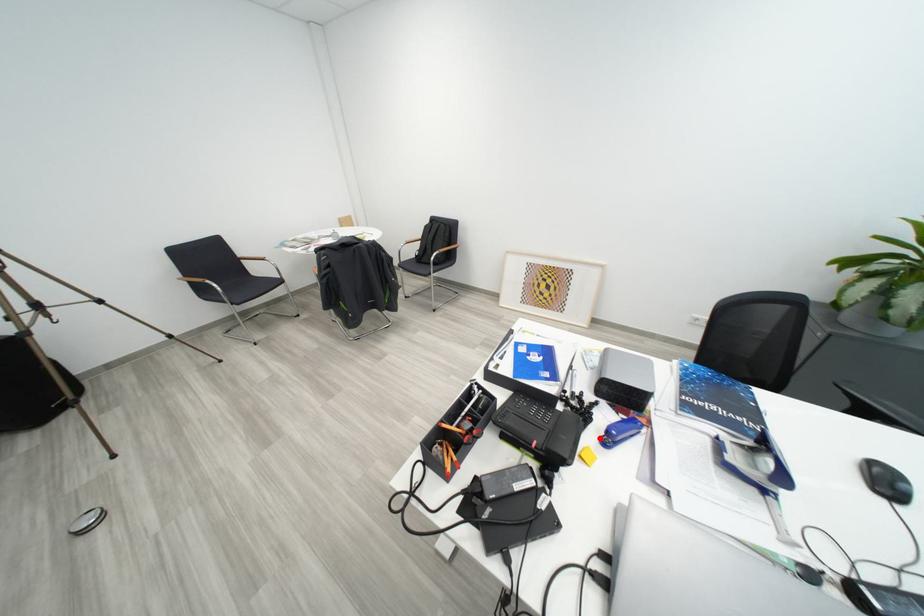
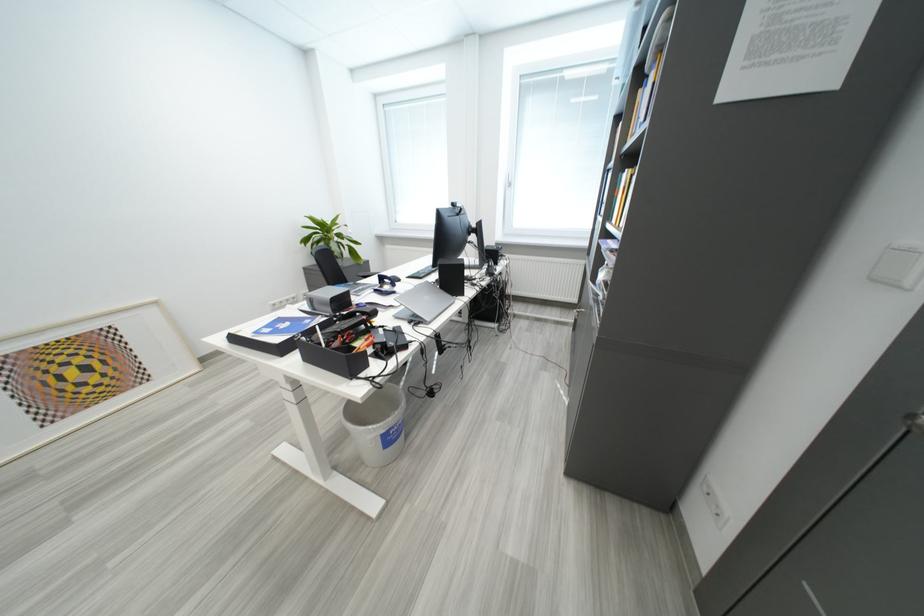
Question: I am providing you with two images of the same scene from different viewpoints. A red point is marked on the first image. At the location where the point appears in image 1, is it still visible in image 2?

Choices:
 (A) Yes
 (B) No

Answer: (B)